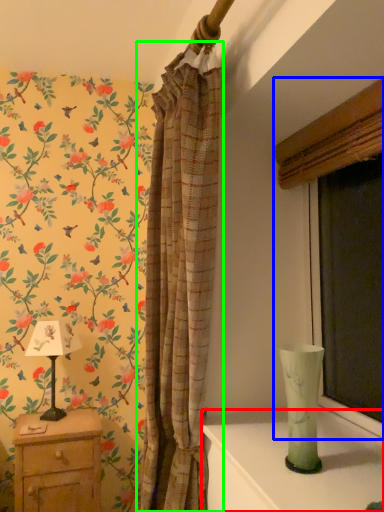
Question: Which object is positioned closest to table (highlighted by a red box)? Select from window (highlighted by a blue box) and curtain (highlighted by a green box).

Choices:
 (A) window
 (B) curtain

Answer: (B)